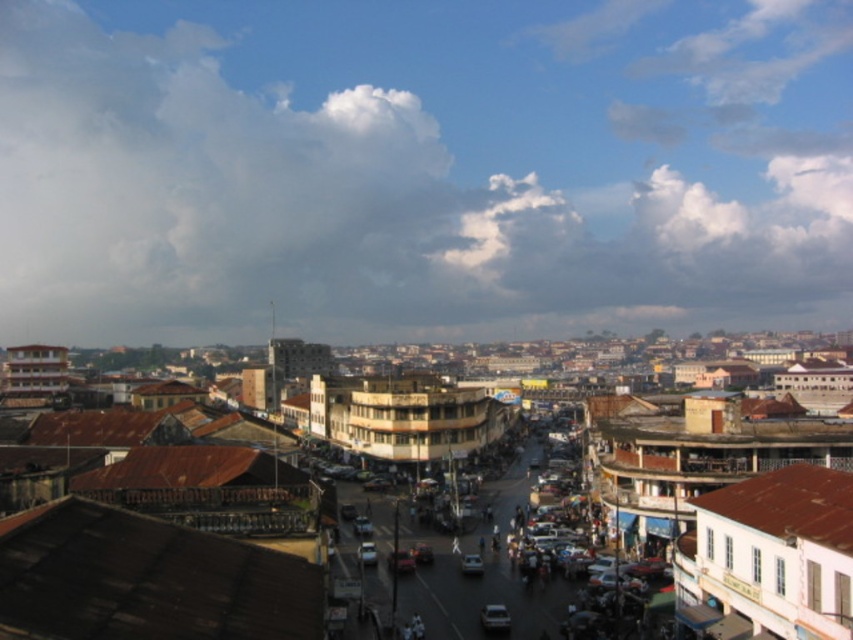
You are standing on the sidewalk in the bustling urban scene. You see the brown corrugated metal roofs at center and the metallic silver car at center. Which object is nearer to you?

The brown corrugated metal roofs at center are closer to the viewer than the metallic silver car at center.

You are a delivery drone flying over the city. You need to deliver a package to a location marked by point (18,236) and then to another location marked by point (463,572). According to the image, which point should you visit first to ensure you can see both points clearly during your flight?

You should visit point (463,572) first because point (18,236) is behind it. Visiting the closer point first allows you to maintain visibility over both locations during your flight route.